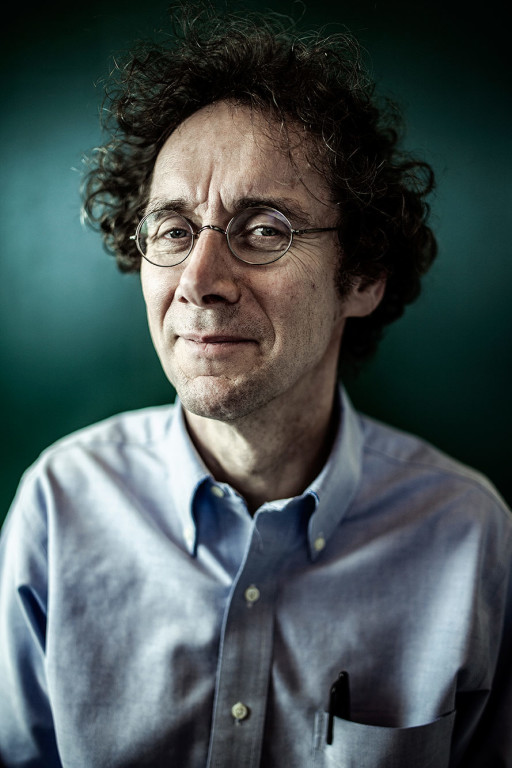
Identify the location of pen. This screenshot has width=512, height=768. [344, 692].